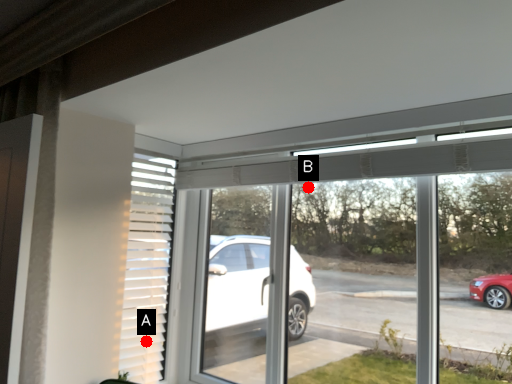
Question: Two points are circled on the image, labeled by A and B beside each circle. Among these points, which one is farthest from the camera?

Choices:
 (A) A is further
 (B) B is further

Answer: (B)